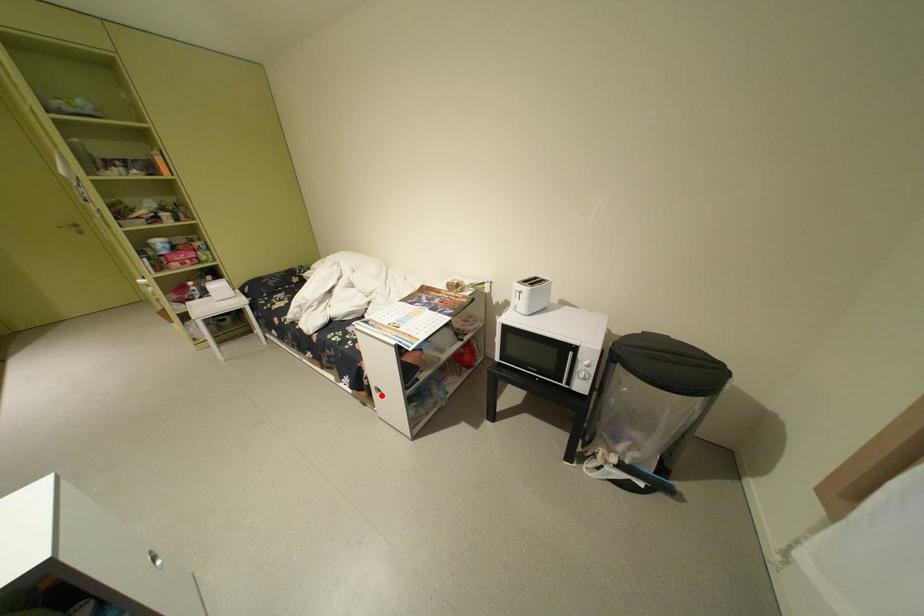
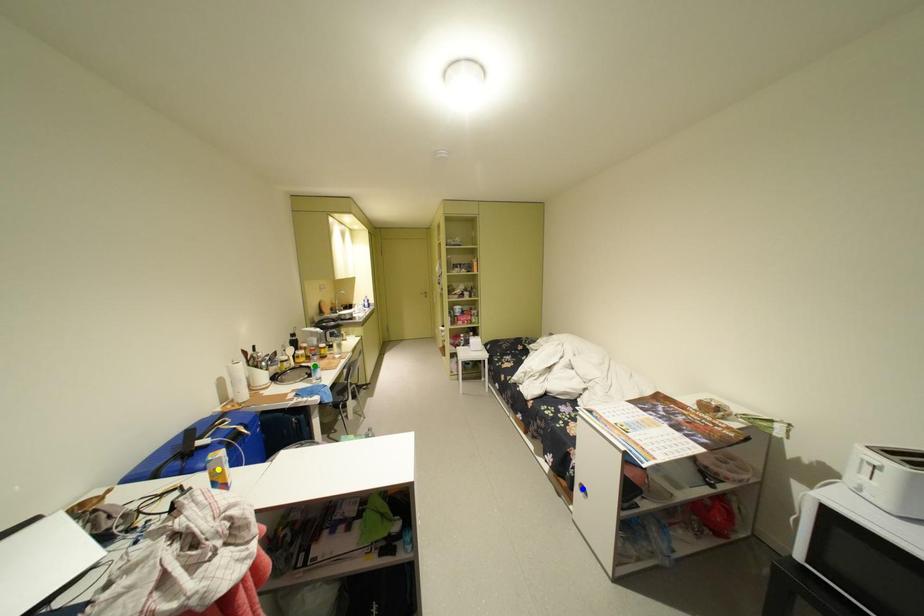
Question: I am providing you with two images of the same scene from different viewpoints. A red point is marked on the first image. You are given multiple points on the second image. Which point in image 2 is actually the same real-world point as the red point in image 1?

Choices:
 (A) yellow point
 (B) blue point
 (C) green point

Answer: (B)